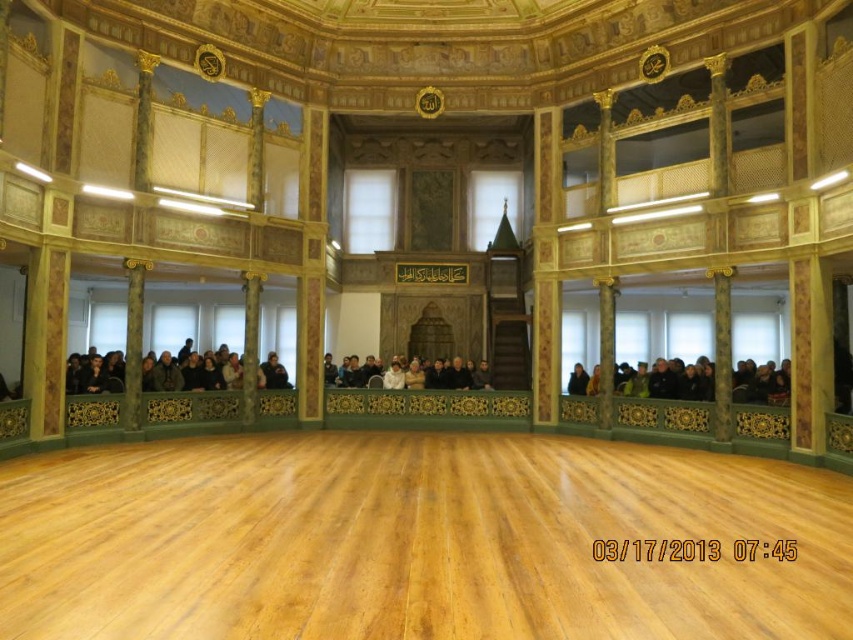
Looking at this image, between dark brown leather jacket at lower right and dark gray fabric crowd at center, which one is positioned higher?

dark brown leather jacket at lower right

Can you confirm if dark brown leather jacket at lower right is positioned to the left of dark gray fabric crowd at center?

In fact, dark brown leather jacket at lower right is to the right of dark gray fabric crowd at center.

Which is in front, point (759, 380) or point (366, 384)?

Point (759, 380) is in front.

I want to click on dark brown leather jacket at lower right, so click(x=670, y=381).

Is dark brown leather jacket at lower right thinner than dark brown wood crowd at lower left?

Correct, dark brown leather jacket at lower right's width is less than dark brown wood crowd at lower left's.

Looking at this image, can you confirm if dark brown leather jacket at lower right is positioned to the left of dark brown wood crowd at lower left?

Incorrect, dark brown leather jacket at lower right is not on the left side of dark brown wood crowd at lower left.

Which is in front, point (757, 376) or point (83, 378)?

Point (83, 378) is more forward.

This screenshot has height=640, width=853. I want to click on dark brown leather jacket at lower right, so click(670, 381).

Does point (199, 369) come closer to viewer compared to point (480, 368)?

That is True.

Which is more to the left, dark brown wood crowd at lower left or dark gray fabric crowd at center?

dark brown wood crowd at lower left

Which is behind, point (219, 371) or point (437, 378)?

The point (437, 378) is more distant.

Locate an element on the screen. This screenshot has width=853, height=640. dark brown wood crowd at lower left is located at coordinates (189, 372).